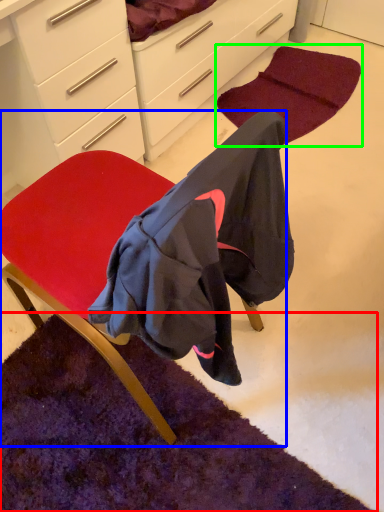
Question: Considering the real-world distances, which object is farthest from mat (highlighted by a red box)? chair (highlighted by a blue box) or mat (highlighted by a green box)?

Choices:
 (A) chair
 (B) mat

Answer: (B)